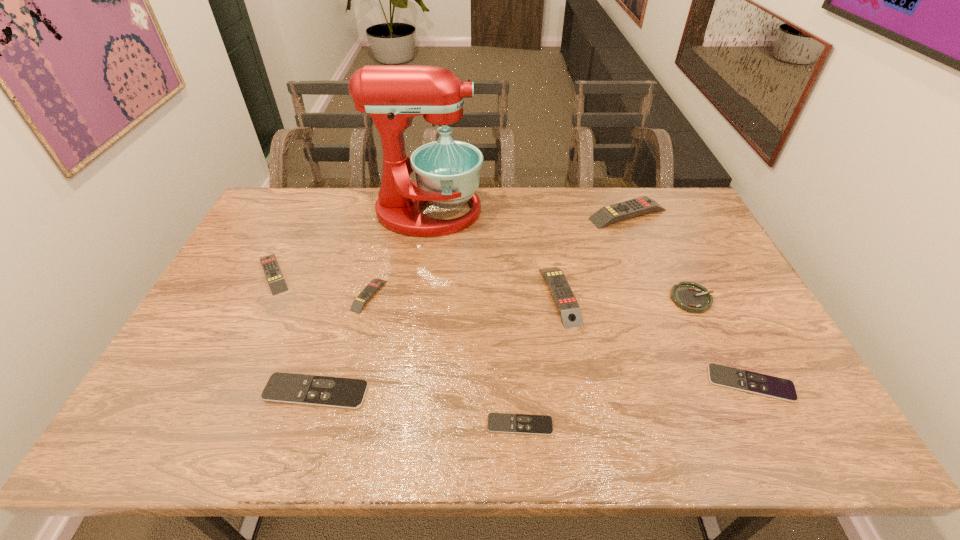
Where is `ashtray that is at the right edge`? The image size is (960, 540). ashtray that is at the right edge is located at coordinates (691, 297).

Identify the location of object present at the far right corner. (609, 214).

Locate an element on the screen. This screenshot has height=540, width=960. free space at the far edge of the desktop is located at coordinates (548, 212).

This screenshot has height=540, width=960. Identify the location of vacant space at the near edge. (424, 434).

I want to click on vacant area at the left edge of the desktop, so click(260, 227).

Image resolution: width=960 pixels, height=540 pixels. In the image, there is a desktop. Find the location of `vacant space at the right edge`. vacant space at the right edge is located at coordinates pos(748,334).

Locate an element on the screen. Image resolution: width=960 pixels, height=540 pixels. free space at the far left corner is located at coordinates (279, 197).

Where is `unoccupied position between the ashtray and the second shortest remote control`? The image size is (960, 540). unoccupied position between the ashtray and the second shortest remote control is located at coordinates (721, 341).

Where is `free space between the fourth shortest remote control and the tallest remote control`? free space between the fourth shortest remote control and the tallest remote control is located at coordinates (498, 255).

Find the location of a particular element. free area in between the tallest object and the fourth remote control from left to right is located at coordinates (474, 318).